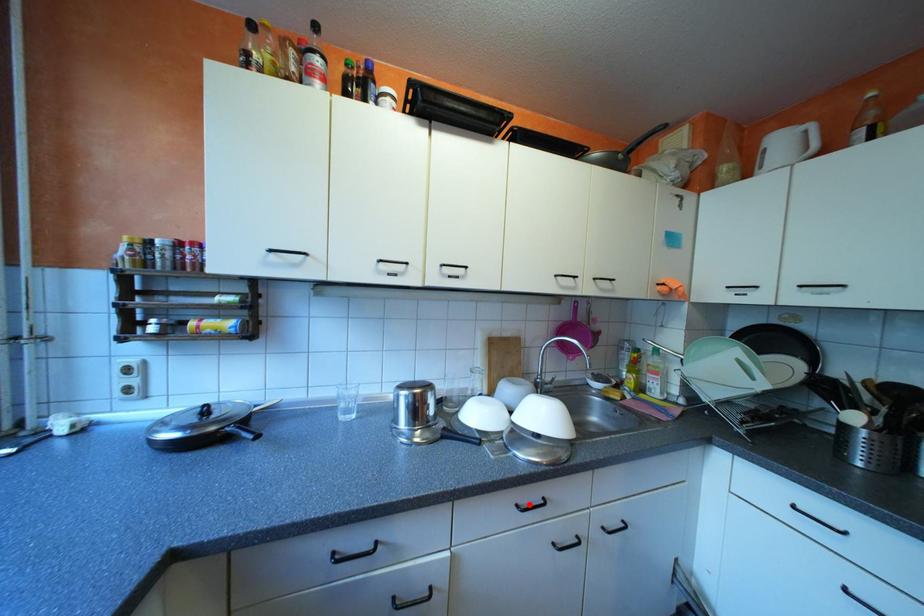
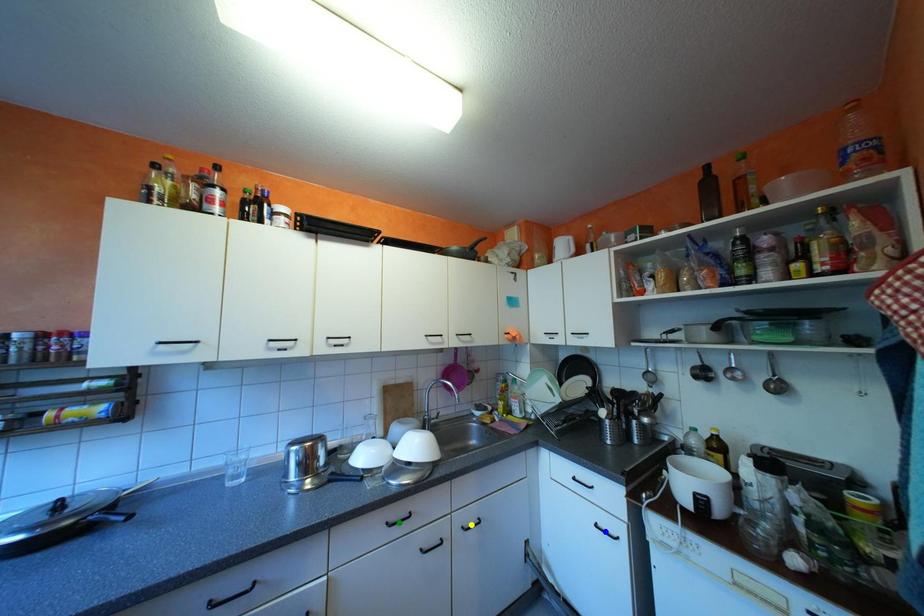
Question: I am providing you with two images of the same scene from different viewpoints. A red point is marked on the first image. You are given multiple points on the second image. Which spot in image 2 lines up with the point in image 1?

Choices:
 (A) blue point
 (B) green point
 (C) yellow point

Answer: (B)